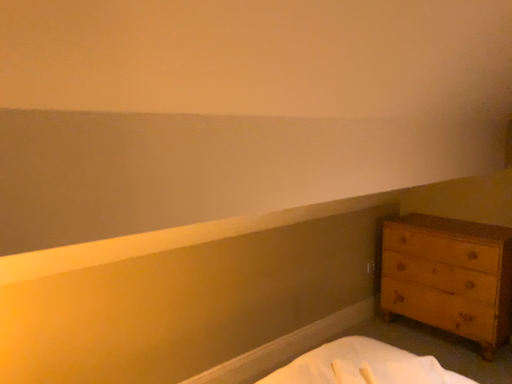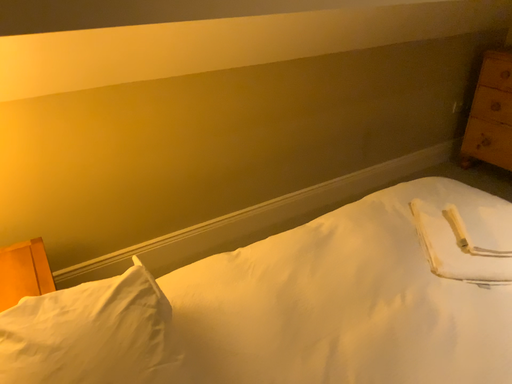
Question: How did the camera likely rotate when shooting the video?

Choices:
 (A) rotated right
 (B) rotated left

Answer: (B)